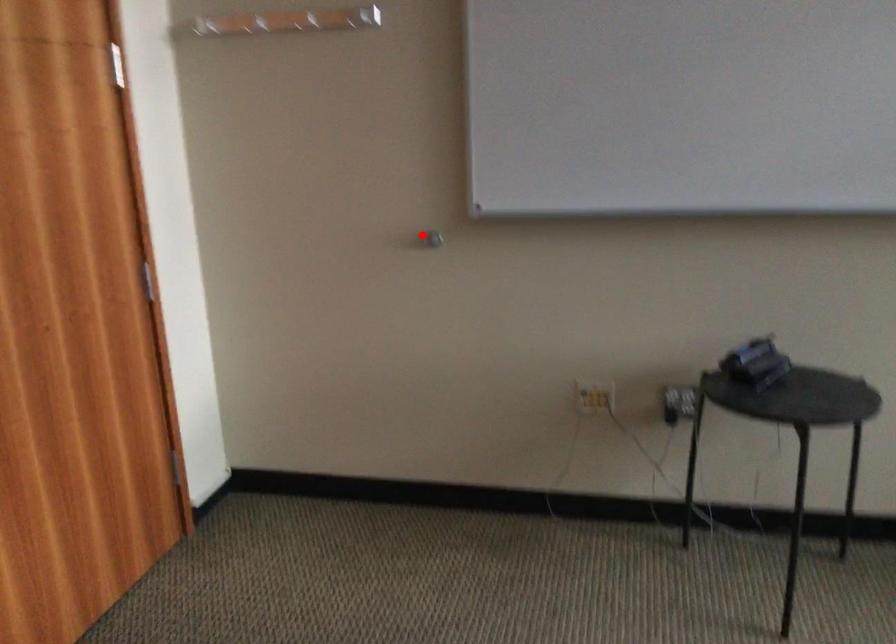
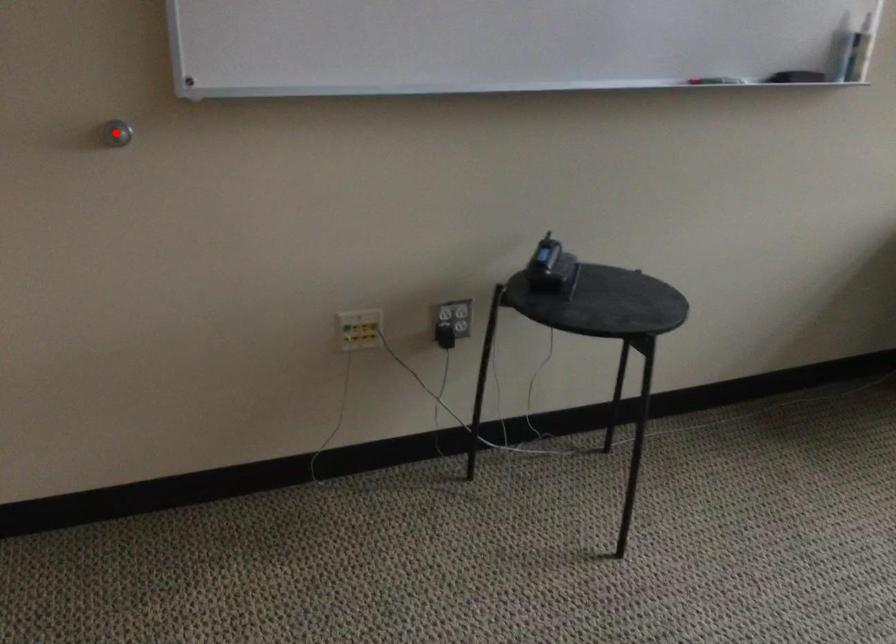
I am providing you with two images of the same scene from different viewpoints. A red point is marked on the first image and another point is marked on the second image. Are the points marked in image1 and image2 representing the same 3D position?

Yes